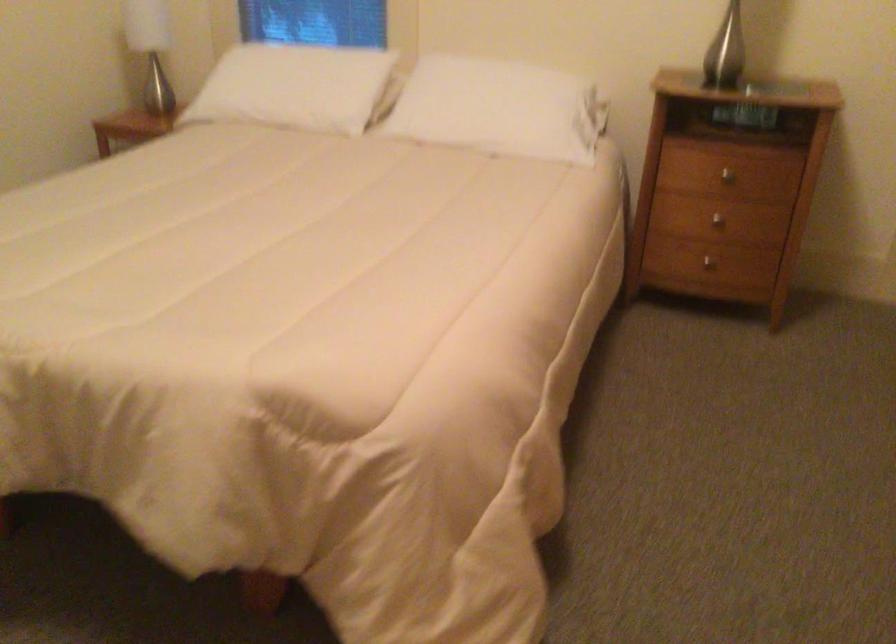
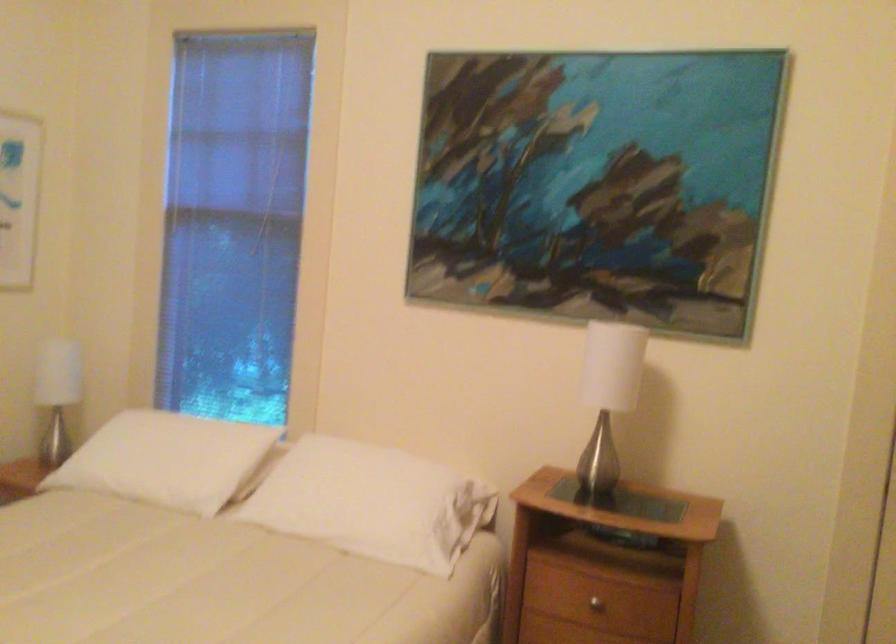
Find the pixel in the second image that matches pixel 504 104 in the first image.

(373, 502)